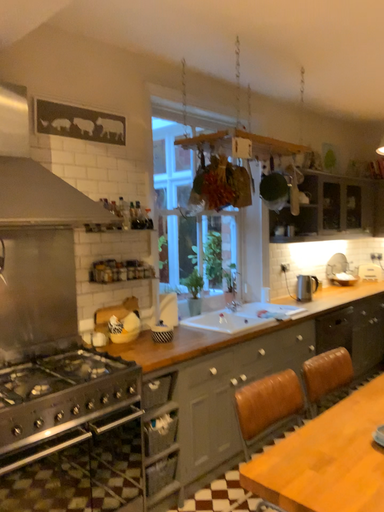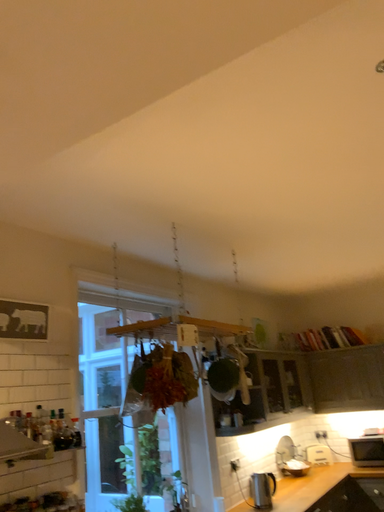
Question: How did the camera likely rotate when shooting the video?

Choices:
 (A) rotated right
 (B) rotated left

Answer: (A)